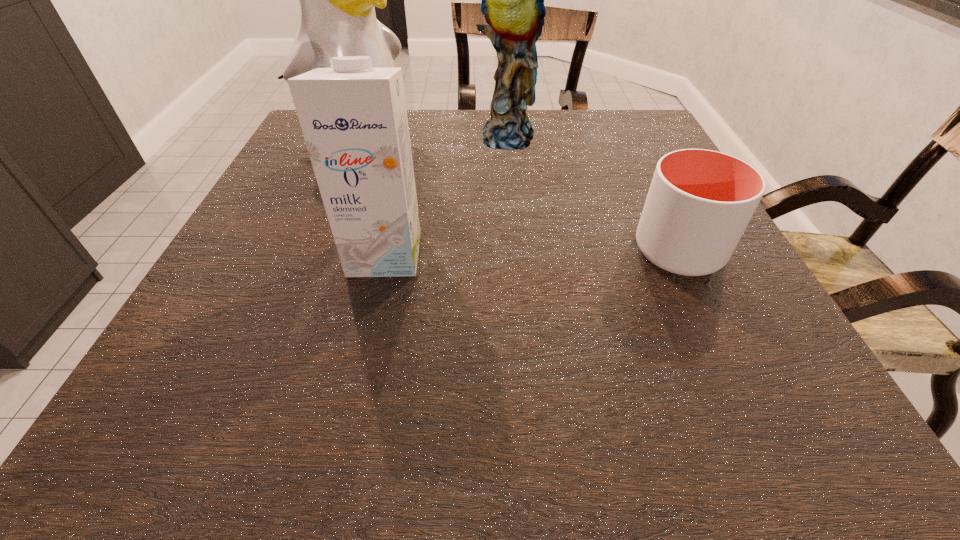
Find the location of a particular element. Image resolution: width=960 pixels, height=540 pixels. free space on the desktop that is between the carton and the rightmost object and is positioned on the face of the second object from right to left is located at coordinates (532, 252).

The width and height of the screenshot is (960, 540). Identify the location of vacant space on the desktop that is between the third tallest object and the cup and is positioned on the beak of the gull. (557, 252).